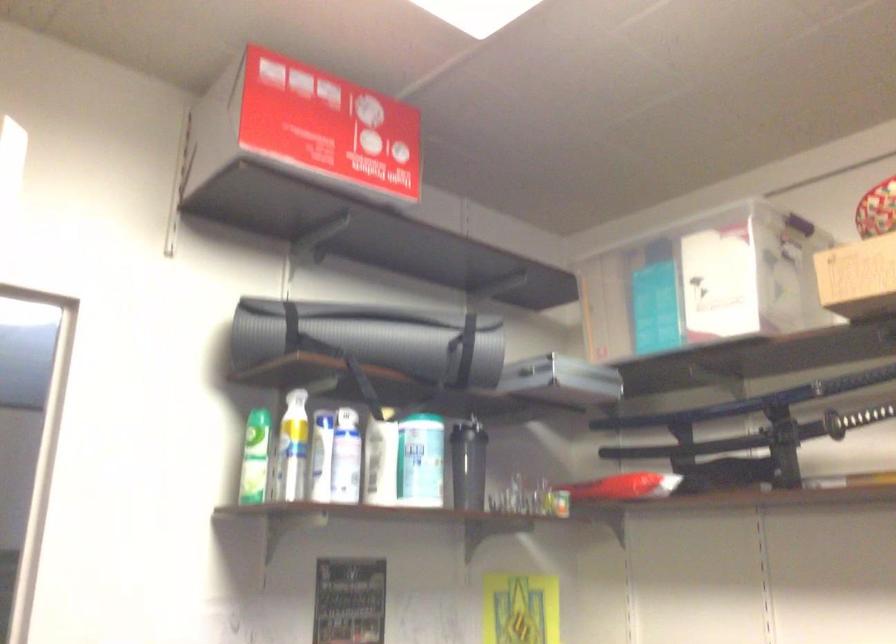
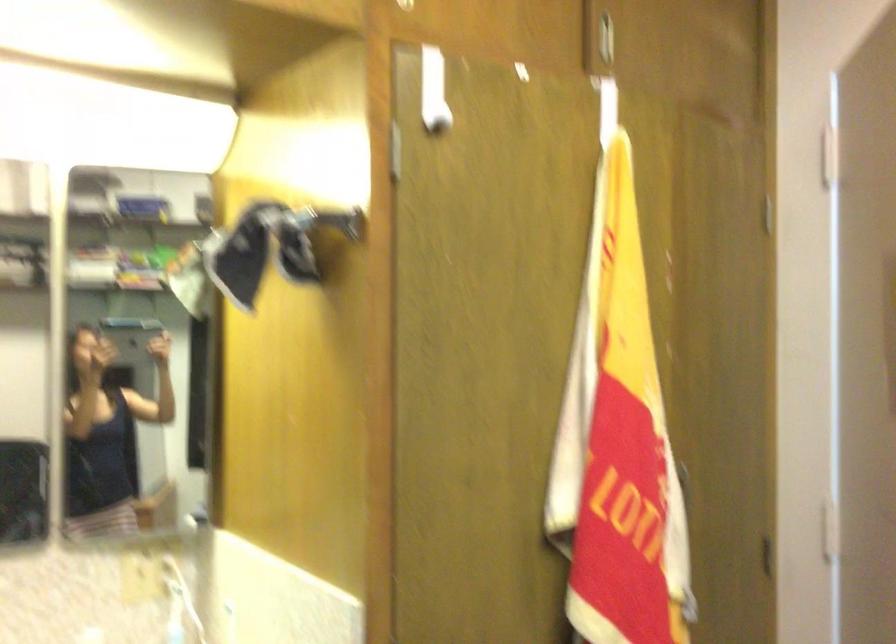
Question: Based on the continuous images, in which direction is the camera rotating? Reply with the corresponding letter.

Choices:
 (A) Left
 (B) Right
 (C) Up
 (D) Down

Answer: (A)